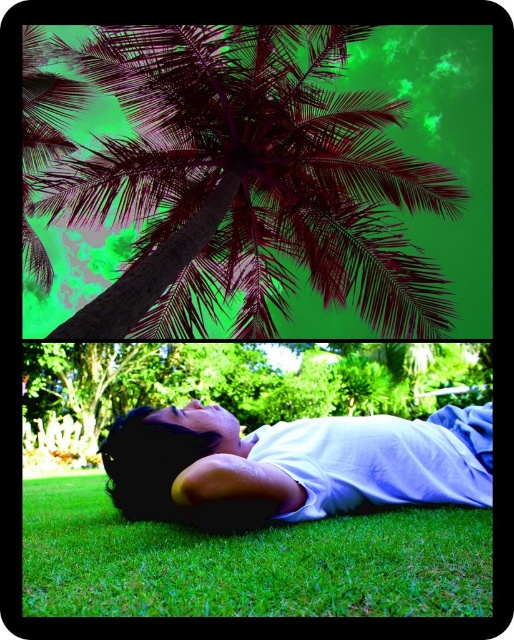
Who is higher up, green soft grass at lower center or green leafy tree at center?

green soft grass at lower center is higher up.

Is green soft grass at lower center below green leafy tree at center?

Actually, green soft grass at lower center is above green leafy tree at center.

Which is in front, point (24, 580) or point (484, 355)?

Point (24, 580)

Where is `green soft grass at lower center`? green soft grass at lower center is located at coordinates (248, 563).

Does dark purple leafy coconut tree at upper center lie in front of green soft grass at lower center?

No, dark purple leafy coconut tree at upper center is further to the viewer.

Between dark purple leafy coconut tree at upper center and green soft grass at lower center, which one is positioned higher?

Positioned higher is dark purple leafy coconut tree at upper center.

Is point (137, 92) less distant than point (128, 563)?

That is False.

Where is `dark purple leafy coconut tree at upper center`? The image size is (514, 640). dark purple leafy coconut tree at upper center is located at coordinates (247, 182).

This screenshot has height=640, width=514. Identify the location of dark purple leafy coconut tree at upper center. tap(247, 182).

Is point (279, 144) positioned before point (447, 458)?

No, (279, 144) is further to viewer.

Between point (320, 224) and point (453, 432), which one is positioned behind?

Point (320, 224)

The height and width of the screenshot is (640, 514). Identify the location of dark purple leafy coconut tree at upper center. (247, 182).